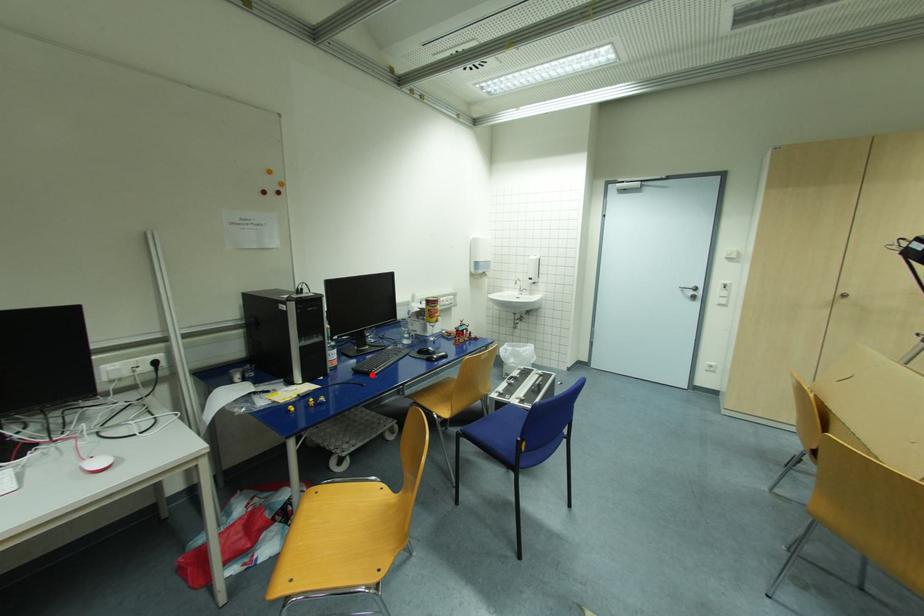
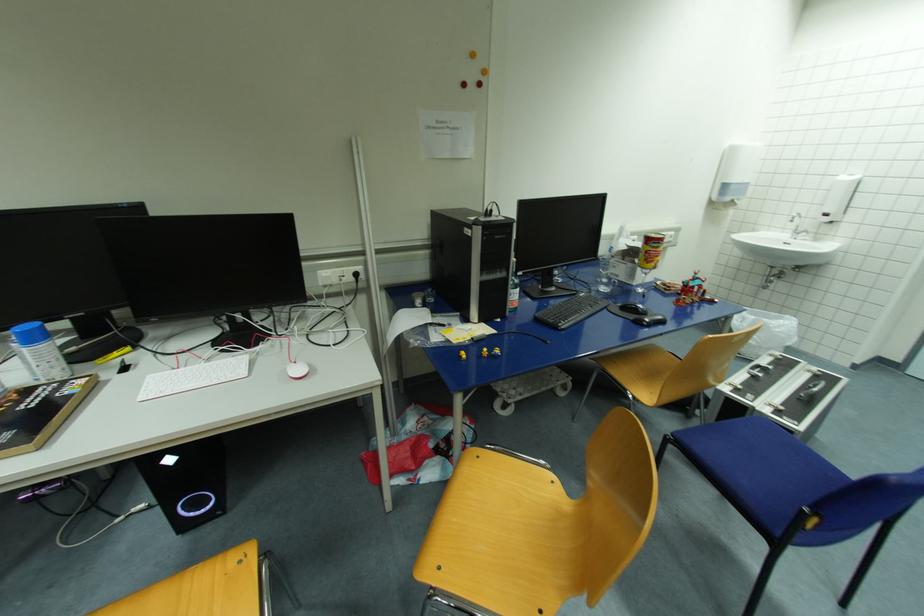
Where in the second image is the point corresponding to the highlighted location from the first image?

(557, 329)